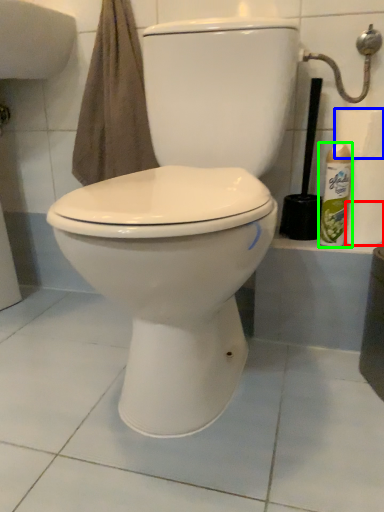
Question: Which object is the closest to the toilet paper (highlighted by a red box)? Choose among these: toilet paper (highlighted by a blue box) or cleaning product (highlighted by a green box).

Choices:
 (A) toilet paper
 (B) cleaning product

Answer: (B)